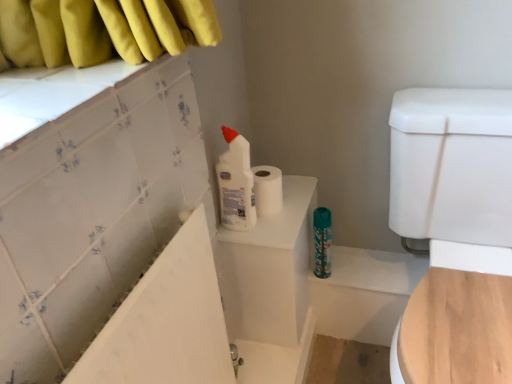
Question: Is the depth of white matte toilet paper at upper center greater than that of teal glossy water bottle at center?

Choices:
 (A) yes
 (B) no

Answer: (B)

Question: Can teal glossy water bottle at center be found inside white matte toilet paper at upper center?

Choices:
 (A) no
 (B) yes

Answer: (A)

Question: Does white matte toilet paper at upper center have a lesser height compared to teal glossy water bottle at center?

Choices:
 (A) no
 (B) yes

Answer: (B)

Question: From a real-world perspective, is white matte toilet paper at upper center on teal glossy water bottle at center?

Choices:
 (A) no
 (B) yes

Answer: (B)

Question: Is white matte toilet paper at upper center oriented away from teal glossy water bottle at center?

Choices:
 (A) yes
 (B) no

Answer: (B)

Question: From a real-world perspective, relative to white plastic bottle at upper center, is white glossy bathtub at upper left vertically above or below?

Choices:
 (A) below
 (B) above

Answer: (A)

Question: Considering the positions of point (189, 332) and point (224, 134), is point (189, 332) closer or farther from the camera than point (224, 134)?

Choices:
 (A) closer
 (B) farther

Answer: (A)

Question: Relative to white plastic bottle at upper center, is white glossy bathtub at upper left in front or behind?

Choices:
 (A) behind
 (B) front

Answer: (B)

Question: Considering the positions of white glossy bathtub at upper left and white plastic bottle at upper center in the image, is white glossy bathtub at upper left wider or thinner than white plastic bottle at upper center?

Choices:
 (A) thin
 (B) wide

Answer: (A)

Question: Considering the positions of white glossy bathtub at upper left and teal glossy water bottle at center in the image, is white glossy bathtub at upper left taller or shorter than teal glossy water bottle at center?

Choices:
 (A) short
 (B) tall

Answer: (B)

Question: Considering the positions of white glossy bathtub at upper left and teal glossy water bottle at center in the image, is white glossy bathtub at upper left wider or thinner than teal glossy water bottle at center?

Choices:
 (A) thin
 (B) wide

Answer: (B)

Question: From the image's perspective, relative to teal glossy water bottle at center, is white glossy bathtub at upper left above or below?

Choices:
 (A) below
 (B) above

Answer: (A)

Question: Relative to teal glossy water bottle at center, is white glossy bathtub at upper left in front or behind?

Choices:
 (A) front
 (B) behind

Answer: (A)

Question: In terms of width, does white plastic bottle at upper center look wider or thinner when compared to teal glossy water bottle at center?

Choices:
 (A) thin
 (B) wide

Answer: (B)

Question: From a real-world perspective, is white plastic bottle at upper center above or below teal glossy water bottle at center?

Choices:
 (A) above
 (B) below

Answer: (A)